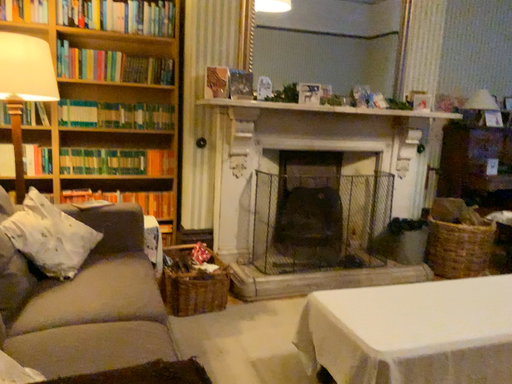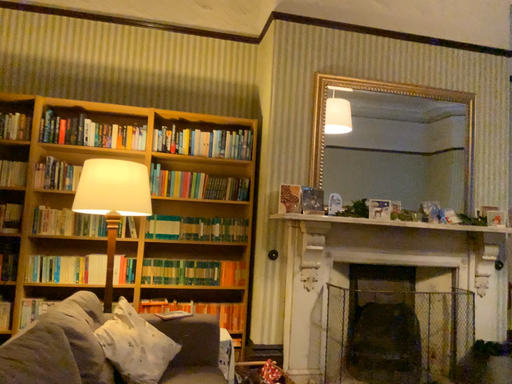
Question: Which way did the camera rotate in the video?

Choices:
 (A) rotated downward
 (B) rotated upward

Answer: (B)